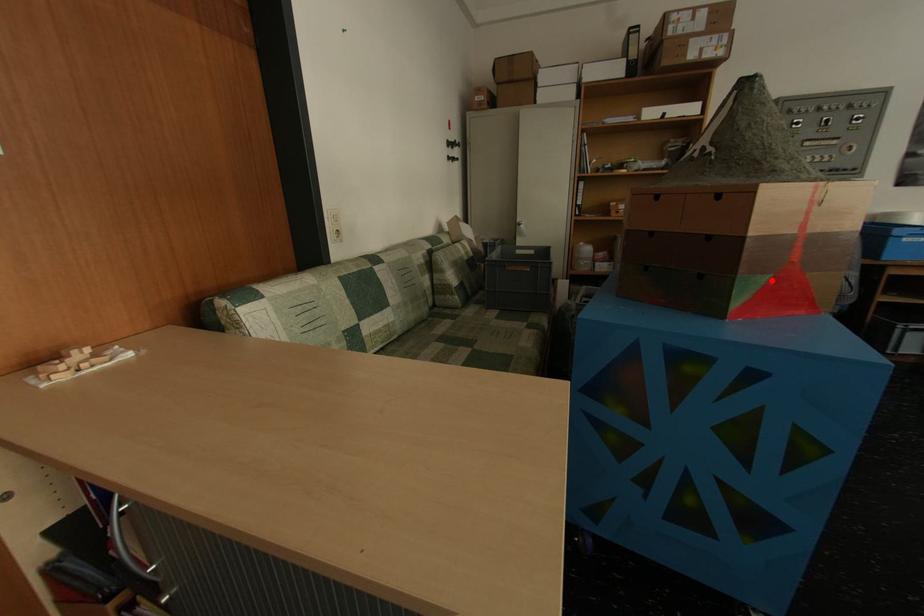
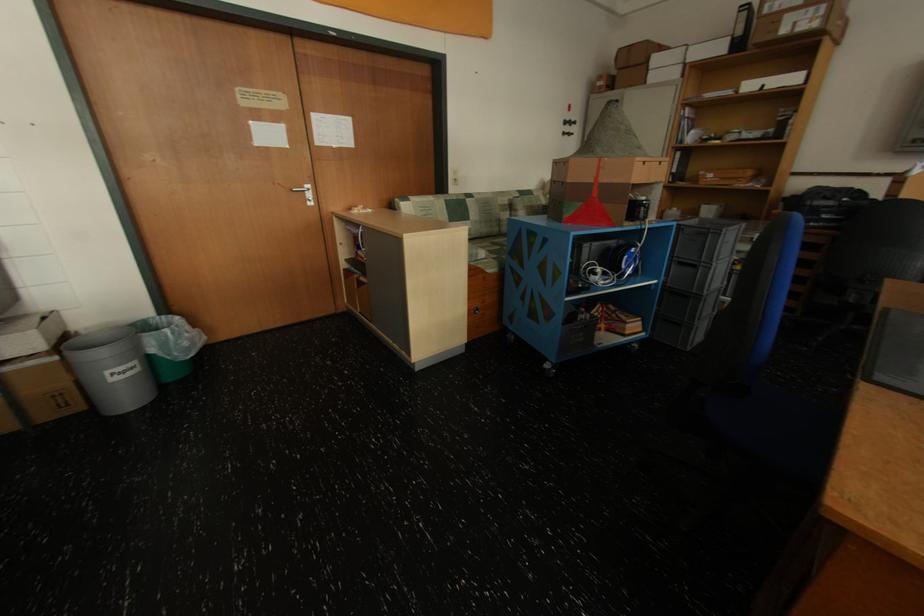
Question: I am providing you with two images of the same scene from different viewpoints. In image1, a red point is highlighted. Considering the same 3D point in image2, which of the following is correct?

Choices:
 (A) It is closer
 (B) It is farther

Answer: (A)